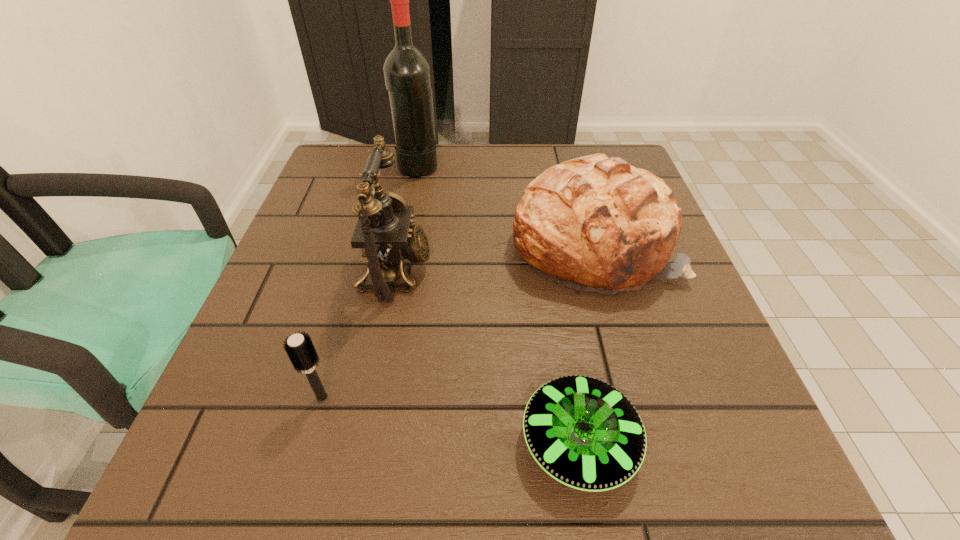
This screenshot has height=540, width=960. What are the coordinates of `object that ranks as the fourth closest to the wine bottle` in the screenshot? It's located at (583, 432).

Identify which object is located as the third nearest to the tallest object. Please provide its 2D coordinates. Your answer should be formatted as a tuple, i.e. [(x, y)], where the tuple contains the x and y coordinates of a point satisfying the conditions above.

[(300, 349)]

The height and width of the screenshot is (540, 960). Identify the location of free region that satisfies the following two spatial constraints: 1. on the rotary dial of the second tallest object; 2. on the left side of the shortest object. (363, 442).

I want to click on free region that satisfies the following two spatial constraints: 1. on the back side of the fourth tallest object; 2. on the left side of the bread, so tap(366, 245).

This screenshot has width=960, height=540. I want to click on free space that satisfies the following two spatial constraints: 1. on the rotary dial of the shortest object; 2. on the right side of the telephone, so click(363, 442).